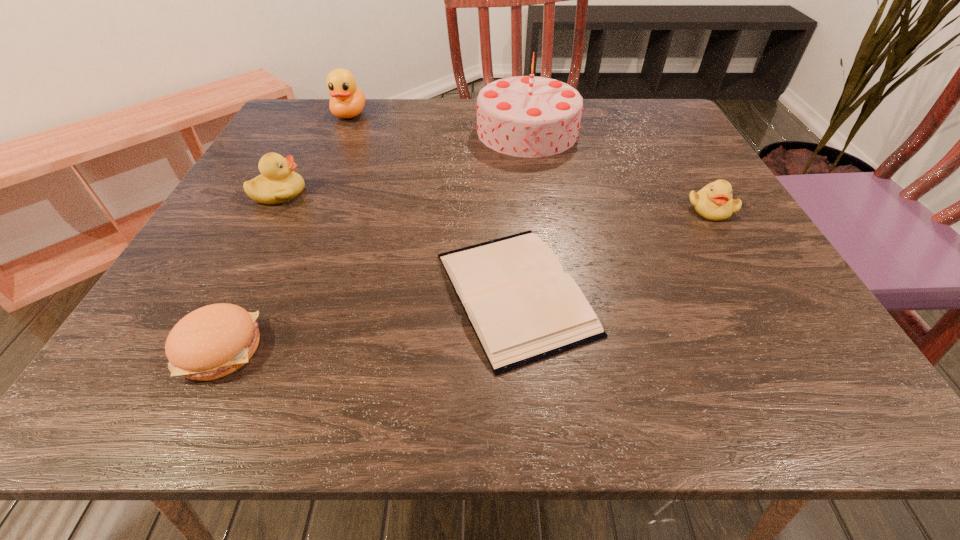
Where is `free space that satisfies the following two spatial constraints: 1. on the back side of the second shortest object; 2. on the left side of the shortest object`? This screenshot has height=540, width=960. free space that satisfies the following two spatial constraints: 1. on the back side of the second shortest object; 2. on the left side of the shortest object is located at coordinates (248, 293).

This screenshot has width=960, height=540. In order to click on vacant space that satisfies the following two spatial constraints: 1. on the face of the hardback book; 2. on the left side of the fifth shortest object in this screenshot , I will do `click(271, 293)`.

Where is `free space that satisfies the following two spatial constraints: 1. on the beak of the third tallest object; 2. on the right side of the fifth tallest object`? The image size is (960, 540). free space that satisfies the following two spatial constraints: 1. on the beak of the third tallest object; 2. on the right side of the fifth tallest object is located at coordinates (196, 348).